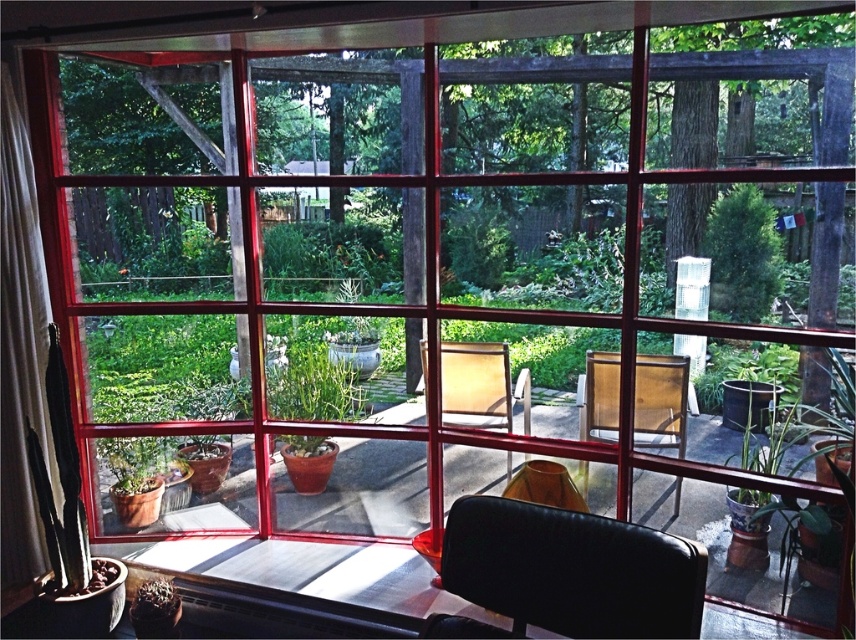
Question: Considering the real-world distances, which object is farthest from the matte yellow chair at center?

Choices:
 (A) black leather armchair at lower center
 (B) matte yellow armchair at center
 (C) green leafy plant at upper right
 (D) white sheer curtain at left

Answer: (D)

Question: Does green leafy plant at upper right appear over matte yellow armchair at center?

Choices:
 (A) yes
 (B) no

Answer: (A)

Question: Can you confirm if black leather armchair at lower center is positioned to the right of matte yellow armchair at center?

Choices:
 (A) no
 (B) yes

Answer: (B)

Question: Considering the real-world distances, which object is farthest from the white sheer curtain at left?

Choices:
 (A) green leafy plant at upper right
 (B) green matte plant at center
 (C) matte yellow armchair at center

Answer: (A)

Question: Which is nearer to the green matte plant at center?

Choices:
 (A) matte yellow armchair at center
 (B) matte yellow chair at center

Answer: (A)

Question: Can you confirm if green leafy plant at upper right is positioned to the right of matte yellow armchair at center?

Choices:
 (A) yes
 (B) no

Answer: (A)